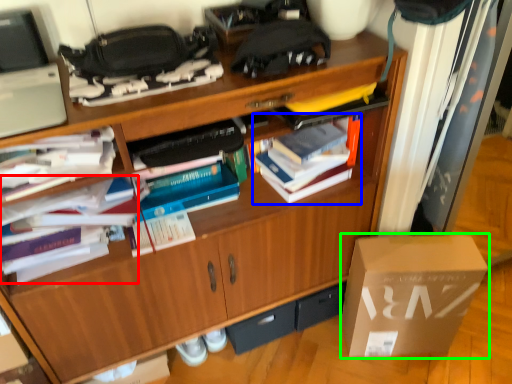
Question: Which object is positioned farthest from book (highlighted by a red box)? Select from book (highlighted by a blue box) and box (highlighted by a green box).

Choices:
 (A) book
 (B) box

Answer: (B)